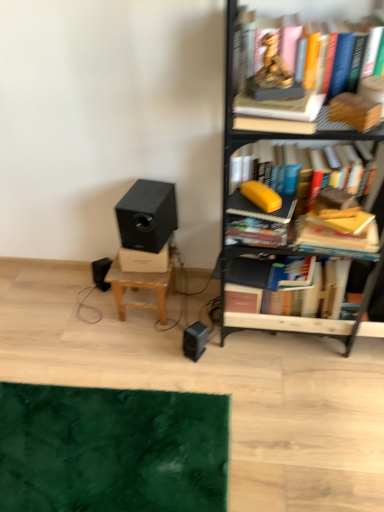
Locate an element on the screen. The width and height of the screenshot is (384, 512). vacant space in wooden stool at lower center (from a real-world perspective) is located at coordinates (150, 311).